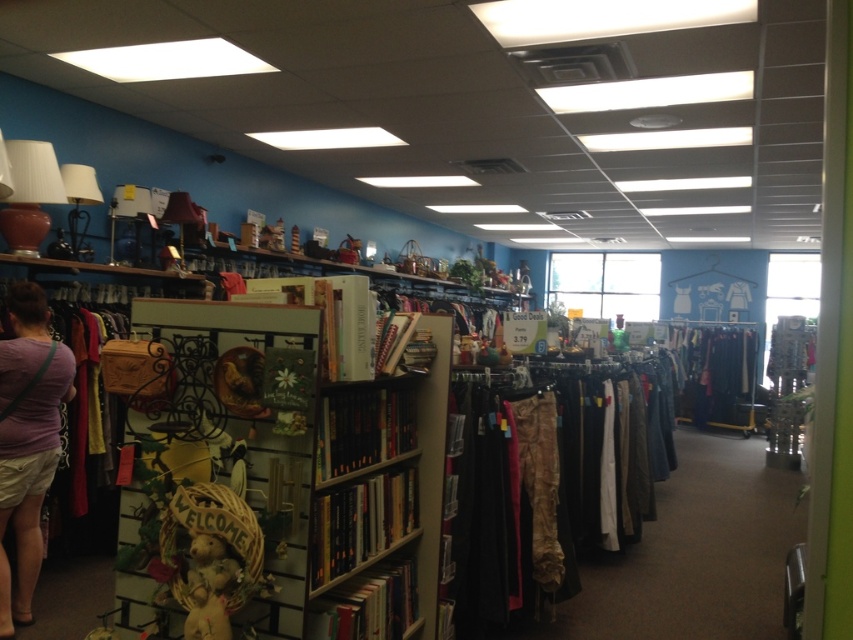
Who is taller, camouflage pants at center or purple cotton shirt at left?

purple cotton shirt at left

Does camouflage pants at center have a smaller size compared to purple cotton shirt at left?

Actually, camouflage pants at center might be larger than purple cotton shirt at left.

What are the coordinates of `camouflage pants at center` in the screenshot? It's located at (549, 481).

Identify the location of camouflage pants at center. (549, 481).

Is purple cotton shirt at left to the left of purple cotton t-shirt at left from the viewer's perspective?

Yes, purple cotton shirt at left is to the left of purple cotton t-shirt at left.

Who is lower down, purple cotton shirt at left or purple cotton t-shirt at left?

purple cotton shirt at left is lower down.

Is point (0, 452) less distant than point (36, 481)?

Yes, it is.

Identify the location of purple cotton shirt at left. (27, 440).

Is wooden bookshelf at center closer to camera compared to purple cotton t-shirt at left?

Yes.

Which is in front, point (128, 436) or point (35, 436)?

Positioned in front is point (128, 436).

Where is `wooden bookshelf at center`? The height and width of the screenshot is (640, 853). wooden bookshelf at center is located at coordinates (287, 477).